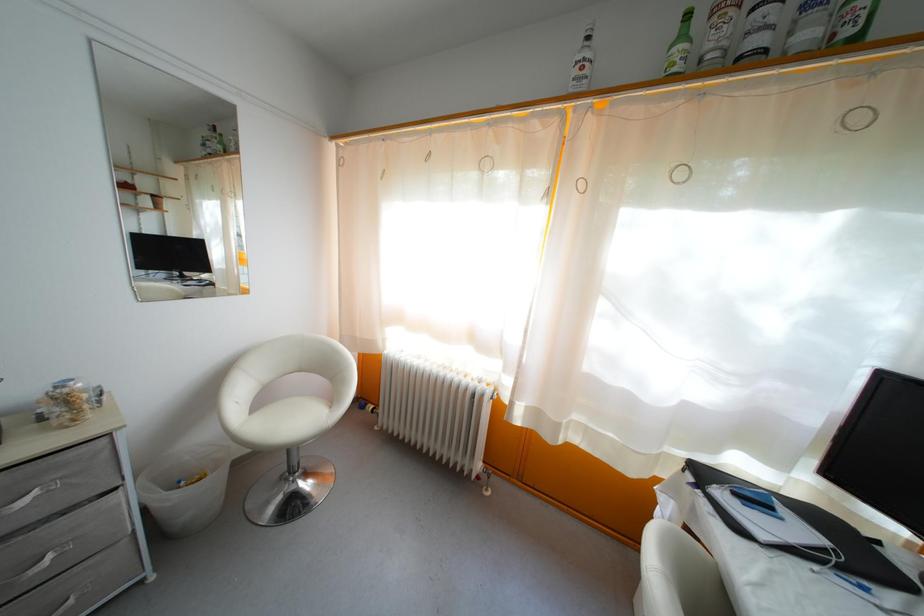
Locate an element on the screen. This screenshot has width=924, height=616. white trash can is located at coordinates (186, 487).